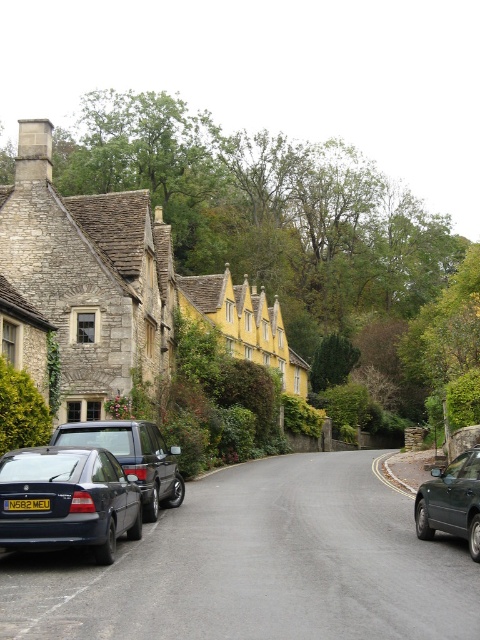
Question: Does matte black car at center have a greater width compared to yellow matte license plate at center?

Choices:
 (A) yes
 (B) no

Answer: (A)

Question: Which object appears closest to the camera in this image?

Choices:
 (A) stone yellow houses at center
 (B) yellow matte license plate at center
 (C) metallic dark green car at right
 (D) matte black car at lower left

Answer: (D)

Question: Considering the real-world distances, which object is closest to the matte black car at lower left?

Choices:
 (A) stone yellow houses at center
 (B) yellow matte license plate at center
 (C) matte black car at center
 (D) metallic dark green car at right

Answer: (B)

Question: Is matte black car at lower left closer to the viewer compared to yellow matte license plate at center?

Choices:
 (A) yes
 (B) no

Answer: (A)

Question: Which object is farther from the camera taking this photo?

Choices:
 (A) metallic dark green car at right
 (B) stone yellow houses at center

Answer: (B)

Question: Is stone yellow houses at center to the right of matte black car at lower left from the viewer's perspective?

Choices:
 (A) yes
 (B) no

Answer: (B)